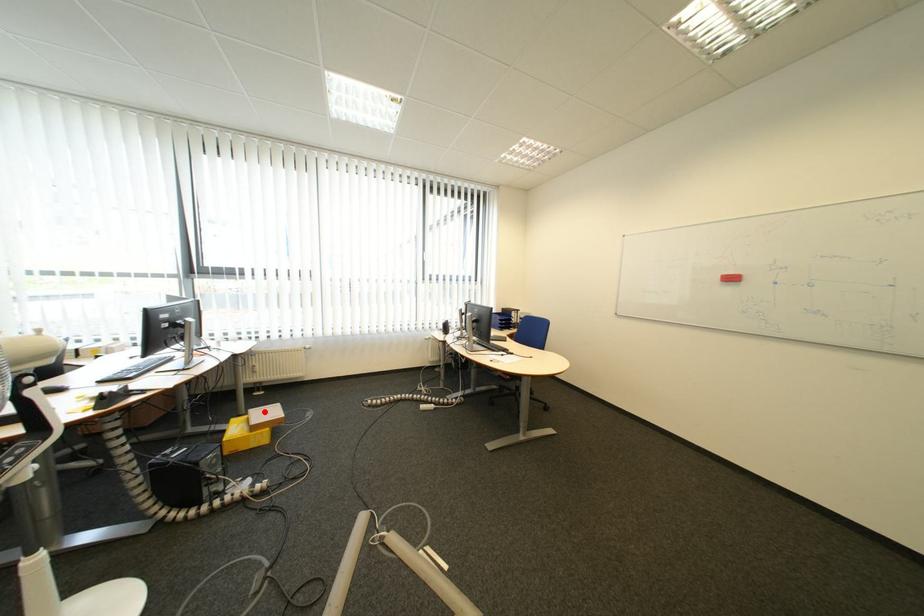
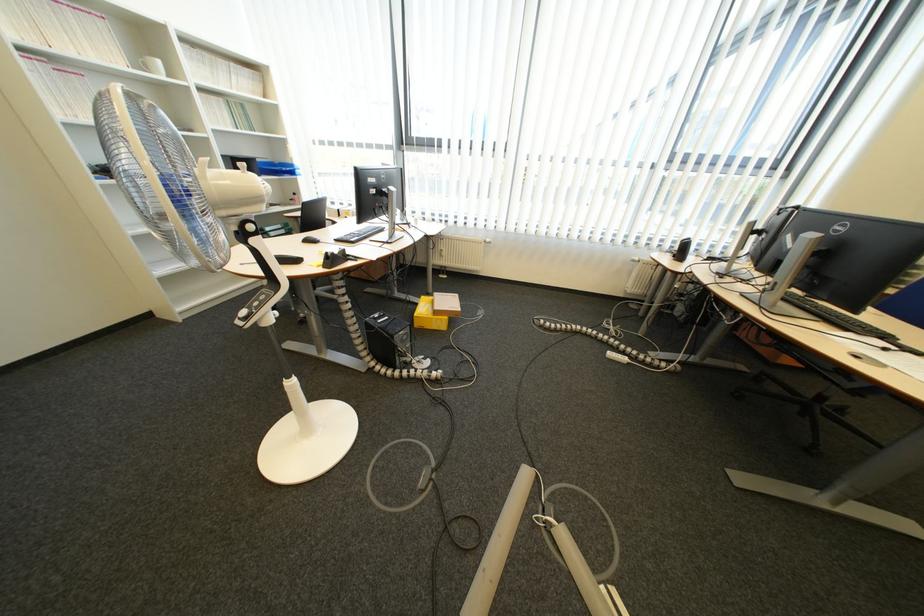
Question: I am providing you with two images of the same scene from different viewpoints. A red point is marked on the first image. Can you still see the location of the red point in image 2?

Choices:
 (A) Yes
 (B) No

Answer: (A)